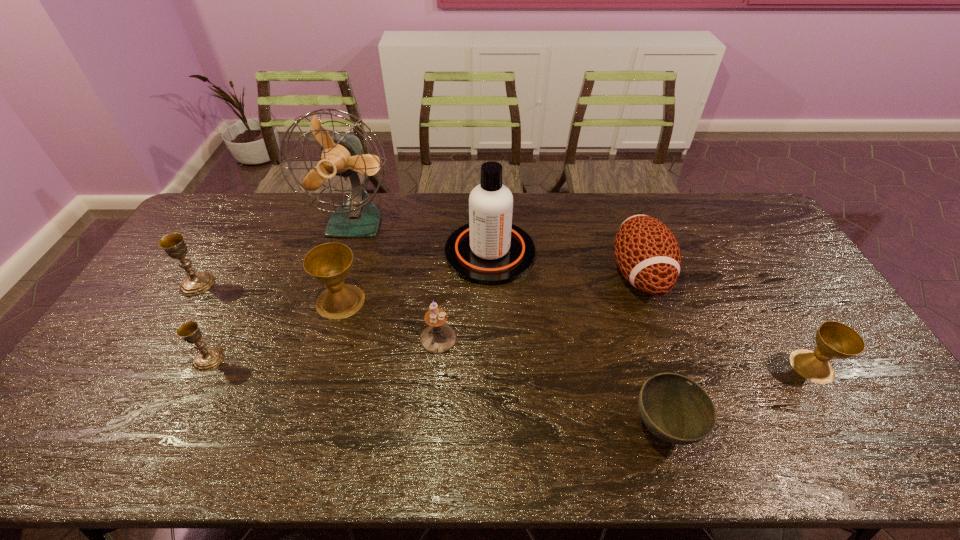
Locate an element on the screen. vacant space that satisfies the following two spatial constraints: 1. on the front side of the left gold chalice; 2. on the right side of the candle holder is located at coordinates [164, 339].